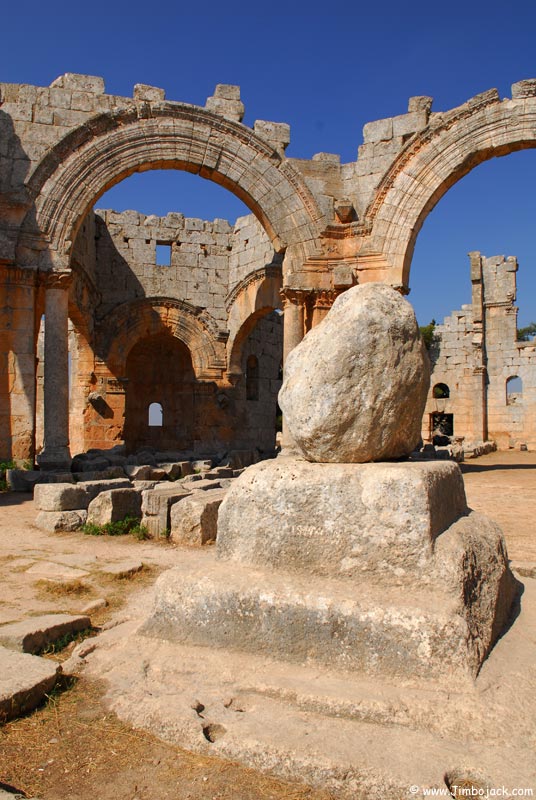
What are the coordinates of `sunlight on wall` in the screenshot? It's located at (203, 270).